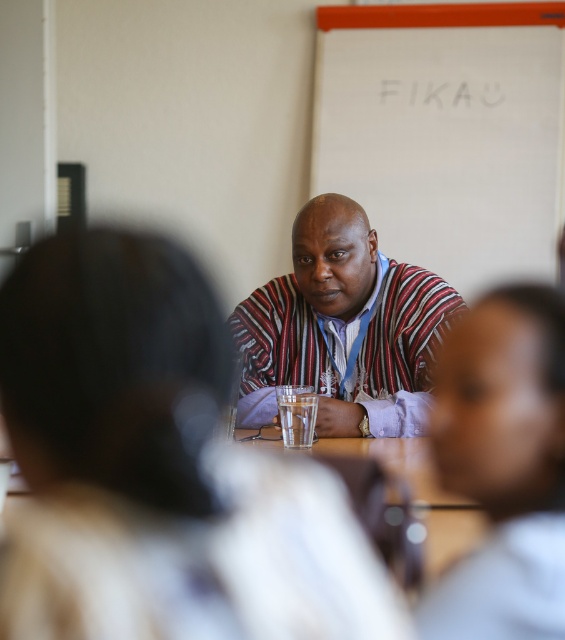
Which is in front, point (525, 76) or point (315, 323)?

Positioned in front is point (315, 323).

Between whiteboard at upper center and striped fabric shirt at center, which one appears on the right side from the viewer's perspective?

whiteboard at upper center is more to the right.

Does point (320, 13) lie behind point (270, 368)?

Yes, point (320, 13) is behind point (270, 368).

Image resolution: width=565 pixels, height=640 pixels. In order to click on whiteboard at upper center in this screenshot , I will do click(446, 131).

Who is positioned more to the left, light gray shirt at center or striped fabric shirt at center?

striped fabric shirt at center is more to the left.

Who is taller, light gray shirt at center or striped fabric shirt at center?

striped fabric shirt at center is taller.

Measure the distance between light gray shirt at center and camera.

70.49 centimeters

The height and width of the screenshot is (640, 565). I want to click on light gray shirt at center, so click(503, 465).

Does whiteboard at upper center have a smaller size compared to light gray shirt at center?

No, whiteboard at upper center is not smaller than light gray shirt at center.

Is point (354, 188) farther from viewer compared to point (444, 448)?

Yes, it is.

Who is more forward, (x=475, y=276) or (x=466, y=356)?

Point (x=466, y=356)

At what (x,y) coordinates should I click in order to perform the action: click on whiteboard at upper center. Please return your answer as a coordinate pair (x, y). Image resolution: width=565 pixels, height=640 pixels. Looking at the image, I should click on (446, 131).